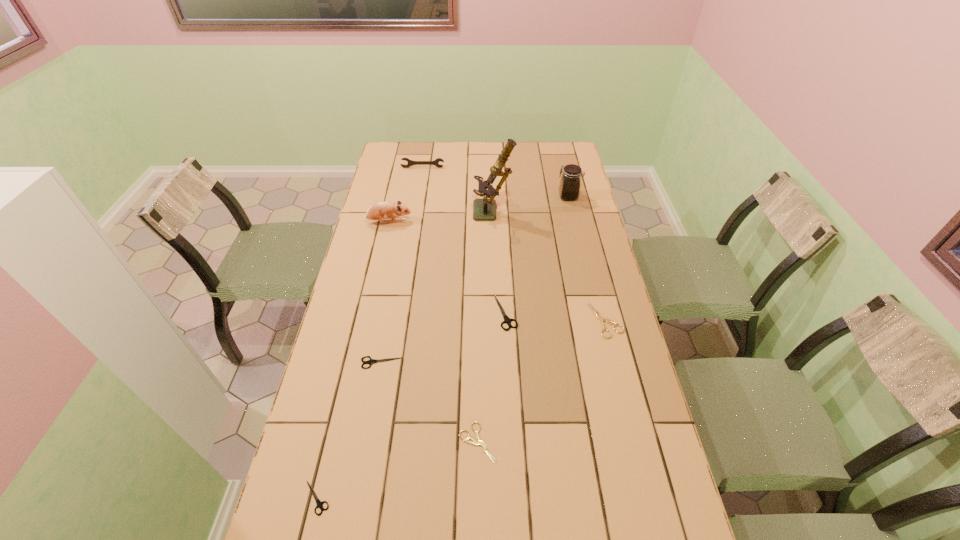
Locate an element on the screen. black shears that is the third closest to the fourth tallest object is located at coordinates (319, 503).

Locate which black shears is the second closest to the eighth shortest object. Please provide its 2D coordinates. Your answer should be formatted as a tuple, i.e. [(x, y)], where the tuple contains the x and y coordinates of a point satisfying the conditions above.

[(371, 361)]

Locate an element on the screen. The width and height of the screenshot is (960, 540). the second closest beige shears to the fourth tallest object is located at coordinates (474, 442).

Where is `beige shears that is the second closest to the fourth tallest object`? The image size is (960, 540). beige shears that is the second closest to the fourth tallest object is located at coordinates (474, 442).

Locate an element on the screen. free space that satisfies the following two spatial constraints: 1. on the open ends of the wrench; 2. at the face of the hamster is located at coordinates (414, 222).